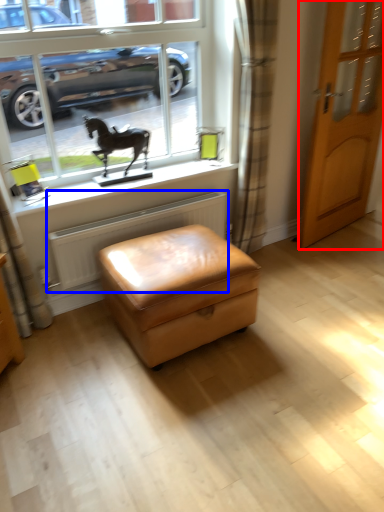
Question: Which object appears farthest to the camera in this image, door (highlighted by a red box) or radiator (highlighted by a blue box)?

Choices:
 (A) door
 (B) radiator

Answer: (A)